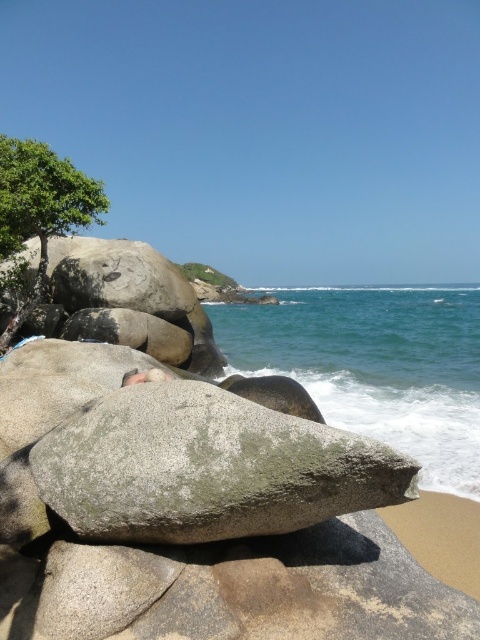
Is point (470, 384) in front of point (106, 196)?

No.

Between blue-green water at center and green leafy tree at upper left, which one has more height?

With more height is blue-green water at center.

Image resolution: width=480 pixels, height=640 pixels. Identify the location of blue-green water at center. (375, 365).

Who is higher up, gray granite rock at center or blue-green water at center?

blue-green water at center is above.

Between point (242, 528) and point (467, 444), which one is positioned behind?

The point (467, 444) is more distant.

Where is `gray granite rock at center`? This screenshot has height=640, width=480. gray granite rock at center is located at coordinates (206, 467).

Is gray granite rock at center thinner than green leafy tree at upper left?

Yes.

Is gray granite rock at center to the left of green leafy tree at upper left from the viewer's perspective?

No, gray granite rock at center is not to the left of green leafy tree at upper left.

Which is in front, point (75, 506) or point (1, 349)?

Point (75, 506) is in front.

At what (x,y) coordinates should I click in order to perform the action: click on gray granite rock at center. Please return your answer as a coordinate pair (x, y). The width and height of the screenshot is (480, 640). Looking at the image, I should click on (206, 467).